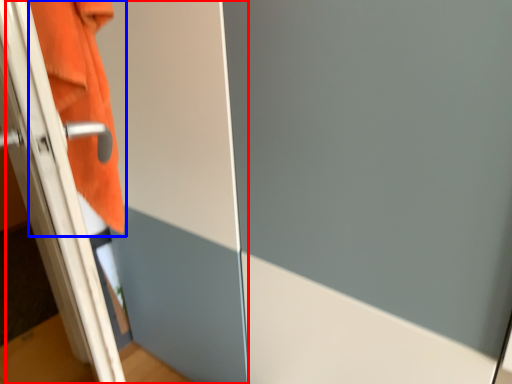
Question: Which object is further to the camera taking this photo, screen door (highlighted by a red box) or bath towel (highlighted by a blue box)?

Choices:
 (A) screen door
 (B) bath towel

Answer: (B)